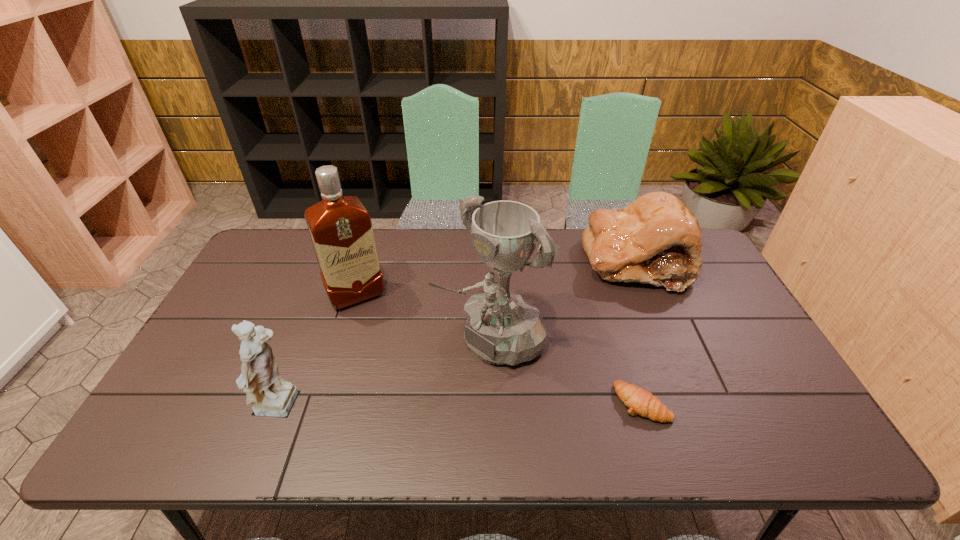
Locate an element on the screen. Image resolution: width=960 pixels, height=540 pixels. free space on the desktop that is between the third tallest object and the shortest object and is positioned on the filling side of the second shortest object is located at coordinates (514, 405).

You are a GUI agent. You are given a task and a screenshot of the screen. Output one action in this format:
    pyautogui.click(x=<x>, y=<y>)
    Task: Click on the free space on the desktop that is between the figurine and the shortest object and is positioned on the side with emblem of the third object from right to left
    This screenshot has height=540, width=960.
    Given the screenshot: What is the action you would take?
    pyautogui.click(x=413, y=407)

Locate an element on the screen. vacant spot on the desktop that is between the figurine and the shortest object and is positioned on the front label of the liquor is located at coordinates (414, 406).